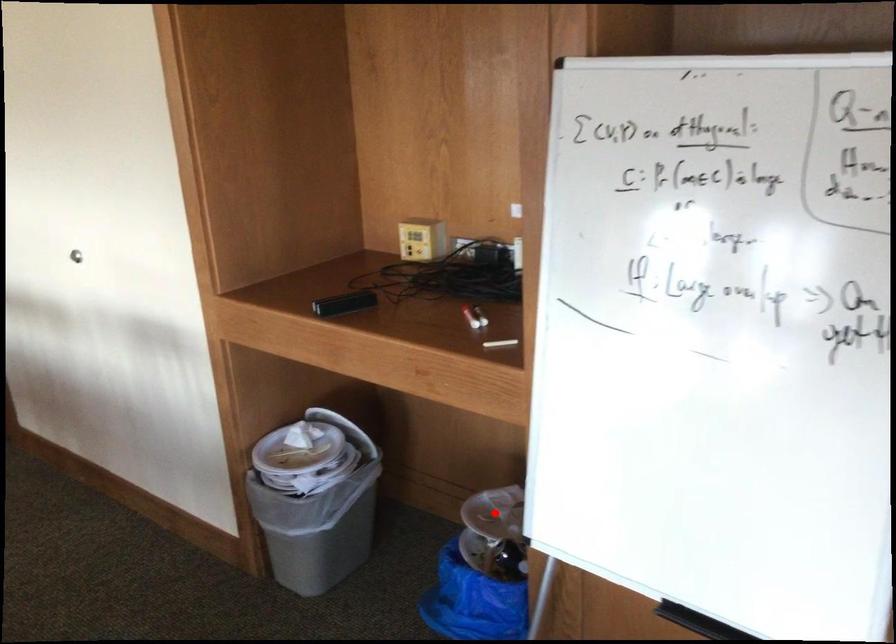
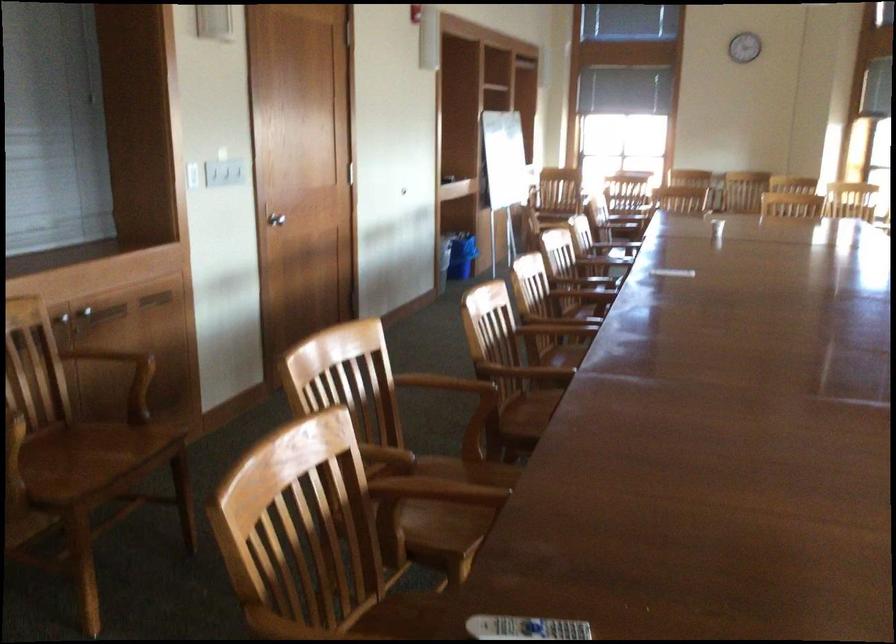
Question: I am providing you with two images of the same scene from different viewpoints. A red point is marked on the first image. Is the red point's position out of view in image 2?

Choices:
 (A) Yes
 (B) No

Answer: (A)